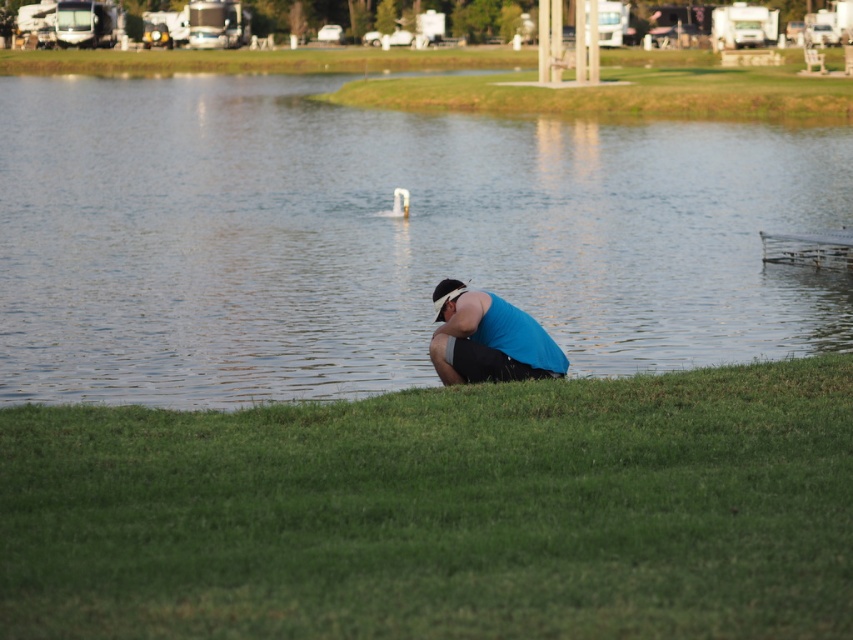
Question: Considering the real-world distances, which object is farthest from the blue fabric at center?

Choices:
 (A) green grass at lower center
 (B) clear water at center

Answer: (B)

Question: Can you confirm if green grass at lower center is smaller than blue fabric at center?

Choices:
 (A) no
 (B) yes

Answer: (A)

Question: Can you confirm if clear water at center is positioned to the left of blue fabric at center?

Choices:
 (A) no
 (B) yes

Answer: (A)

Question: Which point appears closest to the camera in this image?

Choices:
 (A) (503, 371)
 (B) (166, 282)
 (C) (412, 442)

Answer: (C)

Question: Observing the image, what is the correct spatial positioning of clear water at center in reference to blue fabric at center?

Choices:
 (A) left
 (B) right

Answer: (B)

Question: Which of the following is the closest to the observer?

Choices:
 (A) clear water at center
 (B) blue fabric at center

Answer: (A)